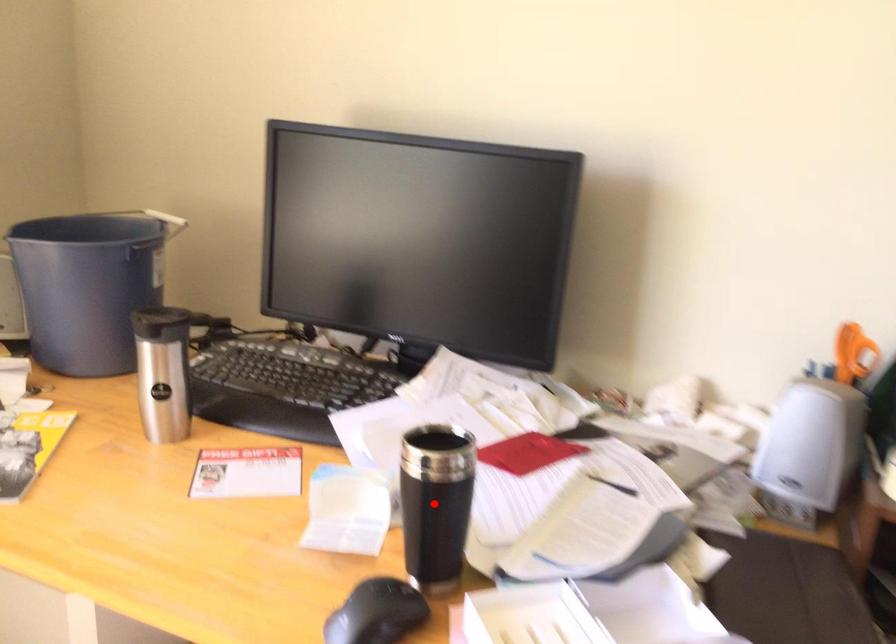
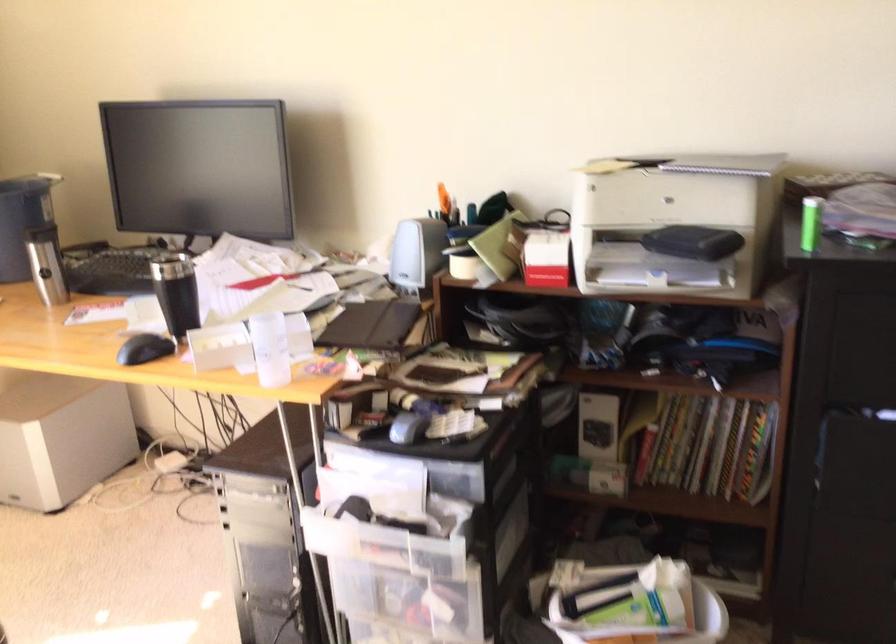
Question: I am providing you with two images of the same scene from different viewpoints. A red point is marked on the first image. Can you still see the location of the red point in image 2?

Choices:
 (A) Yes
 (B) No

Answer: (A)